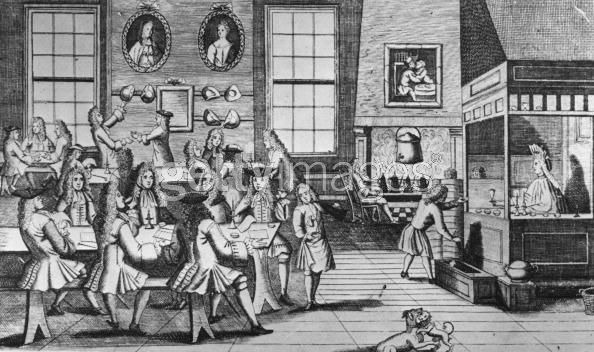
You are a GUI agent. You are given a task and a screenshot of the screen. Output one action in this format:
    pyautogui.click(x=<x>, y=<y>)
    Task: Click on the basket
    This screenshot has width=594, height=352.
    Given the screenshot: What is the action you would take?
    pyautogui.click(x=583, y=297)